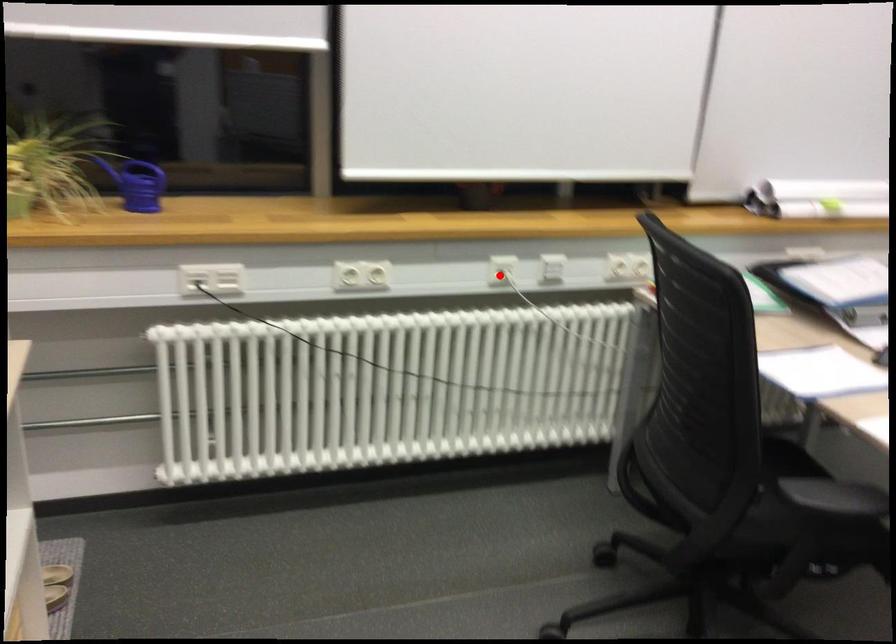
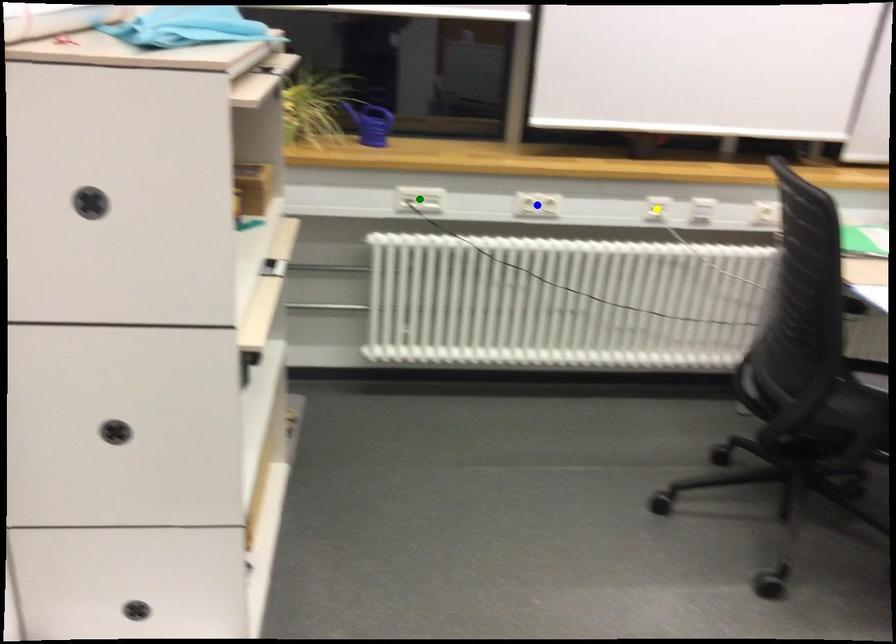
Question: I am providing you with two images of the same scene from different viewpoints. A red point is marked on the first image. You are given multiple points on the second image. Which mark in image 2 goes with the point in image 1?

Choices:
 (A) yellow point
 (B) blue point
 (C) green point

Answer: (A)